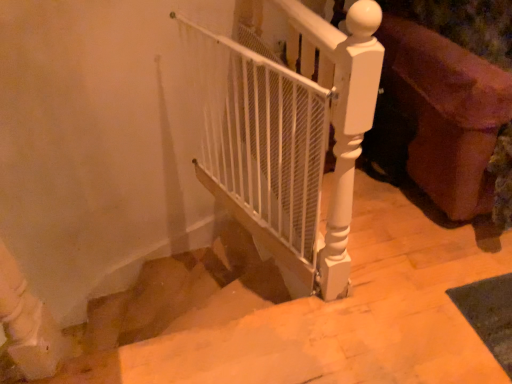
The height and width of the screenshot is (384, 512). I want to click on free space above smooth beige stairs at center (from a real-world perspective), so click(355, 337).